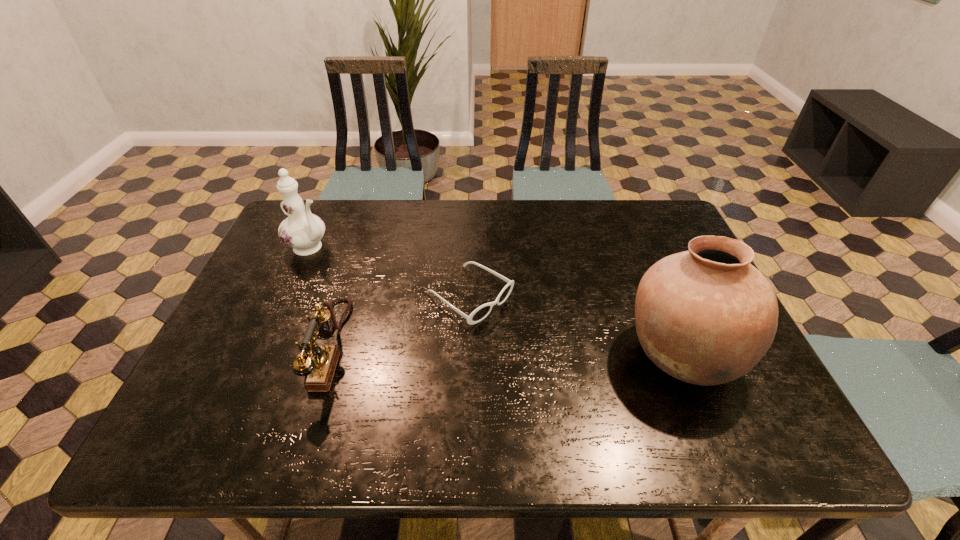
I want to click on object that is at the left edge, so click(x=302, y=231).

At what (x,y) coordinates should I click in order to perform the action: click on object positioned at the right edge. Please return your answer as a coordinate pair (x, y). The width and height of the screenshot is (960, 540). Looking at the image, I should click on (706, 316).

Identify the location of object at the far left corner. (302, 231).

At what (x,y) coordinates should I click in order to perform the action: click on object that is positioned at the near right corner. Please return your answer as a coordinate pair (x, y). Looking at the image, I should click on (706, 316).

You are a GUI agent. You are given a task and a screenshot of the screen. Output one action in this format:
    pyautogui.click(x=<x>, y=<y>)
    Task: Click on the vacant region at the far edge of the desktop
    This screenshot has height=540, width=960.
    Given the screenshot: What is the action you would take?
    pyautogui.click(x=362, y=207)

The image size is (960, 540). I want to click on vacant area at the near edge, so click(x=335, y=385).

In the image, there is a desktop. At what (x,y) coordinates should I click in order to perform the action: click on vacant space at the left edge. Please return your answer as a coordinate pair (x, y). Image resolution: width=960 pixels, height=540 pixels. Looking at the image, I should click on (254, 366).

Find the location of a particular element. vacant space at the right edge of the desktop is located at coordinates (650, 256).

I want to click on free location at the near left corner of the desktop, so (214, 388).

Identify the location of vacant point at the far right corner. This screenshot has height=540, width=960. (631, 213).